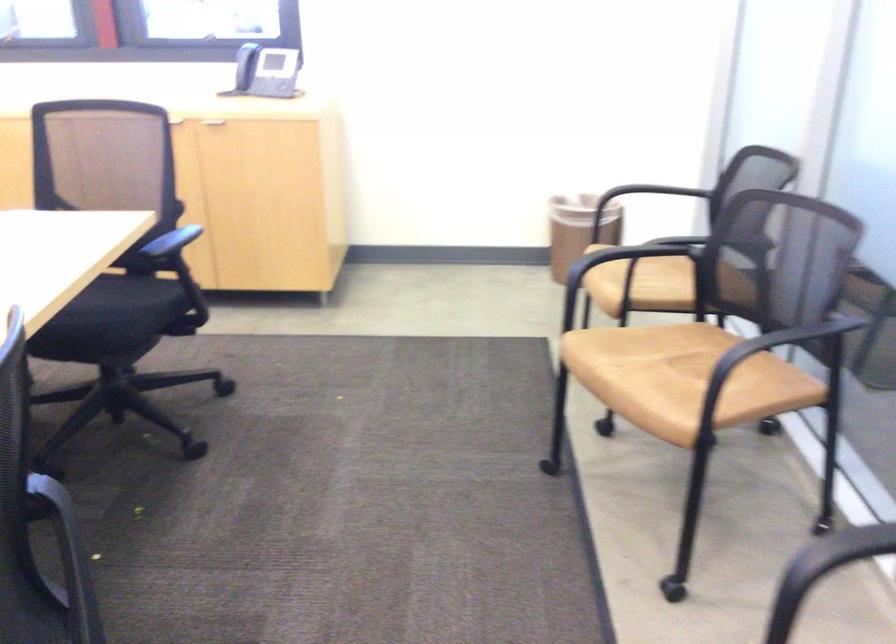
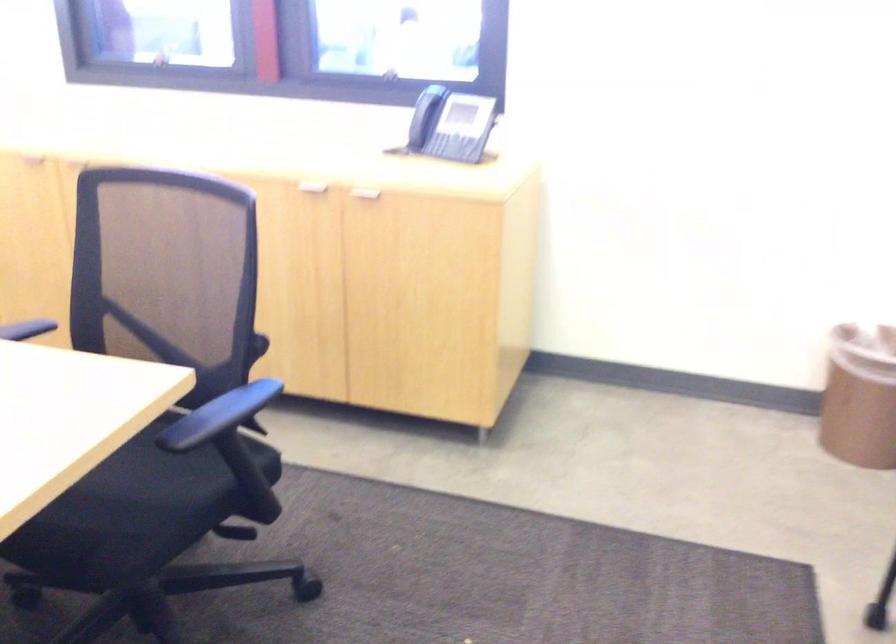
The point at (x=108, y=310) is marked in the first image. Where is the corresponding point in the second image?

(124, 498)